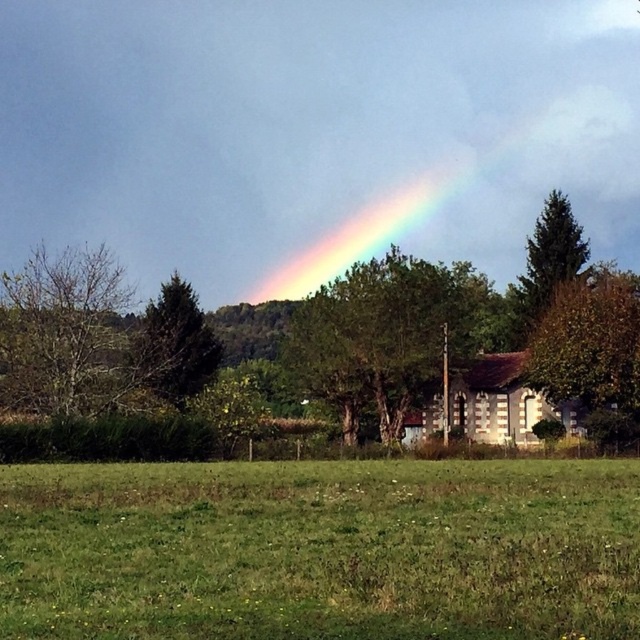
Consider the image. You are a gardener who wants to plant a new flower bed. You have a choice between the green grass at lower center and the area near the brown textured tree at right. Which location would be better for planting if you want your flowers to grow taller?

The area near the brown textured tree at right would be better for planting flowers if you want them to grow taller because the green grass at lower center has lesser height compared to the brown textured tree at right, indicating that the tree area might have richer soil or better conditions for growth.

You are standing in the middle of the field and see the green grass at lower center and the green matte tree at left. Which object is positioned to the right of the other?

The green grass at lower center is to the right of the green matte tree at left.